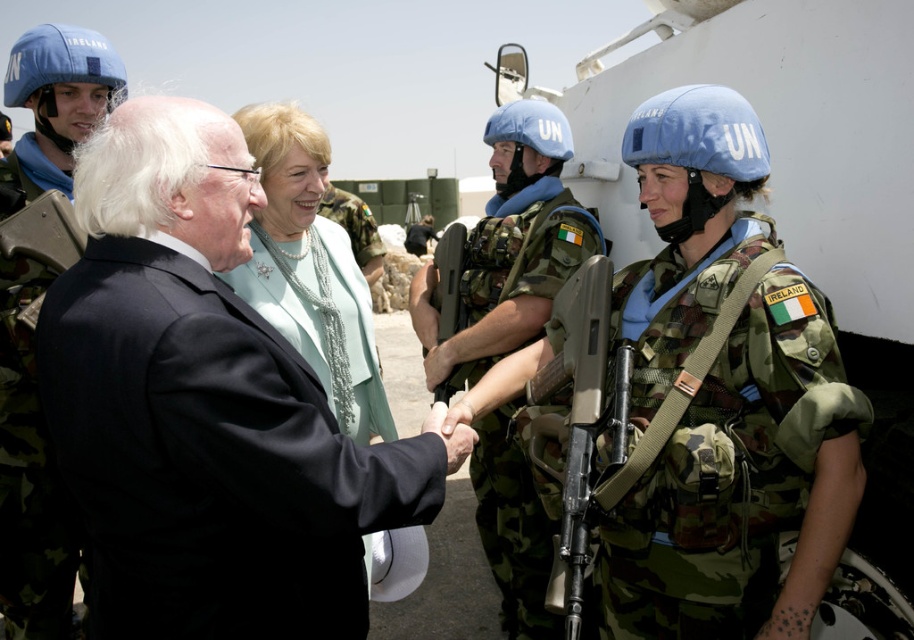
Can you confirm if light green fabric at center is thinner than blue fabric helmet at upper left?

Incorrect, light green fabric at center's width is not less than blue fabric helmet at upper left's.

In the scene shown: Does light green fabric at center appear under blue fabric helmet at upper left?

Yes, light green fabric at center is below blue fabric helmet at upper left.

Is point (285, 221) positioned behind point (41, 96)?

That is False.

Where is `light green fabric at center`? light green fabric at center is located at coordinates (314, 266).

Who is more distant from viewer, (523, 326) or (60, 616)?

Point (523, 326)

Is point (535, 556) positioned in front of point (17, 620)?

No, (535, 556) is behind (17, 620).

Identify the location of camo uniform at center. Image resolution: width=914 pixels, height=640 pixels. (509, 248).

Measure the distance between black suit at center and blue fabric un helmet at center.

black suit at center and blue fabric un helmet at center are 6.71 feet apart.

Is point (254, 330) more distant than point (534, 144)?

No, it is in front of (534, 144).

Which is behind, point (155, 132) or point (519, 156)?

The point (519, 156) is behind.

In order to click on black suit at center in this screenshot , I will do `click(205, 406)`.